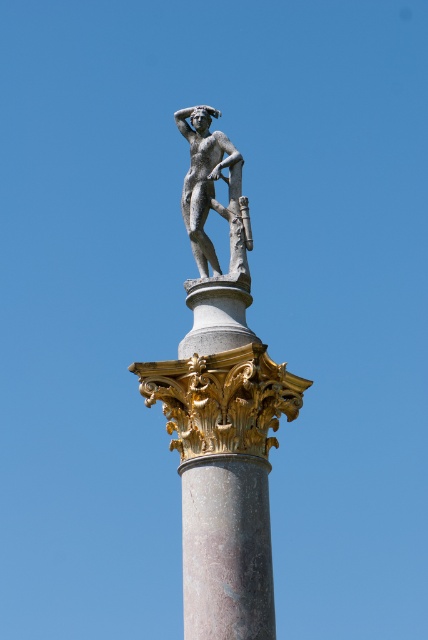
Question: Estimate the real-world distances between objects in this image. Which object is farther from the polished bronze statue at top?

Choices:
 (A) bronze statue at center
 (B) marble column at center

Answer: (B)

Question: Does marble column at center appear on the right side of polished bronze statue at top?

Choices:
 (A) yes
 (B) no

Answer: (B)

Question: Does marble column at center have a smaller size compared to polished bronze statue at top?

Choices:
 (A) yes
 (B) no

Answer: (B)

Question: Which object is the closest to the marble column at center?

Choices:
 (A) bronze statue at center
 (B) polished bronze statue at top

Answer: (A)

Question: Is bronze statue at center to the left of marble column at center from the viewer's perspective?

Choices:
 (A) no
 (B) yes

Answer: (A)

Question: Which object is the closest to the polished bronze statue at top?

Choices:
 (A) bronze statue at center
 (B) marble column at center

Answer: (A)